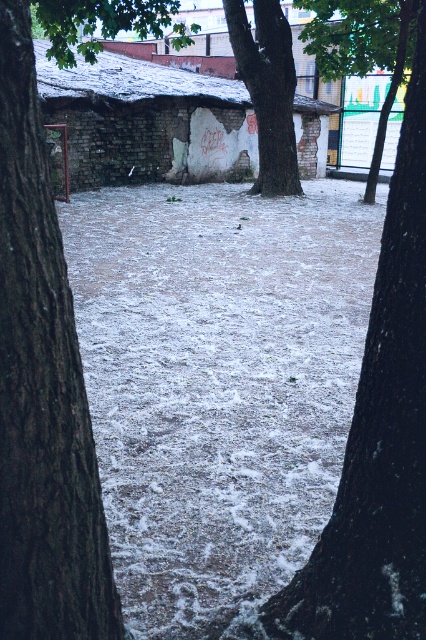
Question: Which point is farther from the camera taking this photo?

Choices:
 (A) (264, 116)
 (B) (81, 522)
 (C) (371, 67)

Answer: (C)

Question: Is brown rough bark at left to the left of smooth brown tree trunk at center from the viewer's perspective?

Choices:
 (A) no
 (B) yes

Answer: (B)

Question: Can you confirm if brown rough bark at left is wider than smooth brown tree trunk at center?

Choices:
 (A) no
 (B) yes

Answer: (A)

Question: Estimate the real-world distances between objects in this image. Which object is closer to the smooth brown tree trunk at center?

Choices:
 (A) brown rough bark at left
 (B) green leafy tree at upper center

Answer: (B)

Question: Which point appears farthest from the camera in this image?

Choices:
 (A) (333, 38)
 (B) (77, 419)
 (C) (267, 29)

Answer: (A)

Question: Is smooth brown tree trunk at center positioned in front of green leafy tree at upper center?

Choices:
 (A) yes
 (B) no

Answer: (A)